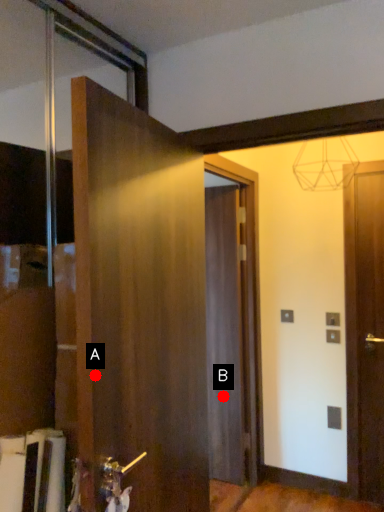
Question: Two points are circled on the image, labeled by A and B beside each circle. Which point is closer to the camera taking this photo?

Choices:
 (A) A is closer
 (B) B is closer

Answer: (A)